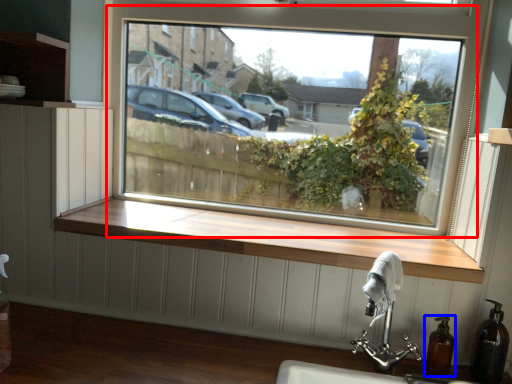
Question: Which of the following is the closest to the observer, window (highlighted by a red box) or soap dispenser (highlighted by a blue box)?

Choices:
 (A) window
 (B) soap dispenser

Answer: (B)